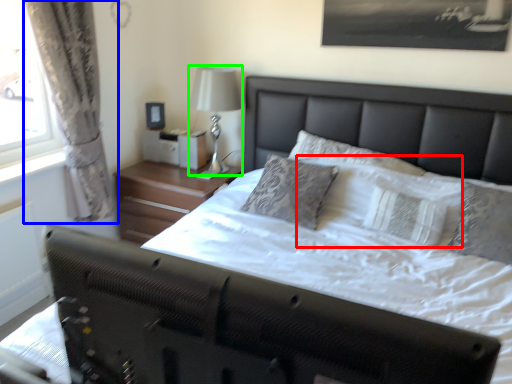
Question: Which object is the closest to the pillow (highlighted by a red box)? Choose among these: curtain (highlighted by a blue box) or bedside lamp (highlighted by a green box).

Choices:
 (A) curtain
 (B) bedside lamp

Answer: (B)